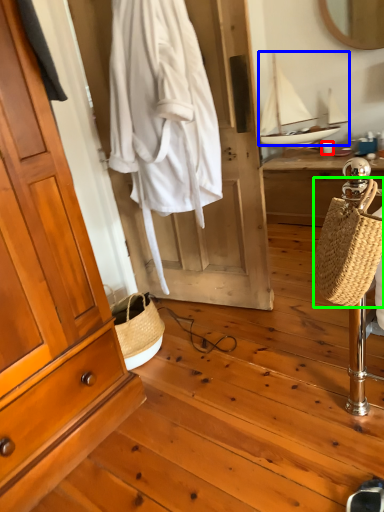
Question: Considering the real-world distances, which object is closest to coffee cup (highlighted by a red box)? sailboat (highlighted by a blue box) or handbag (highlighted by a green box).

Choices:
 (A) sailboat
 (B) handbag

Answer: (A)